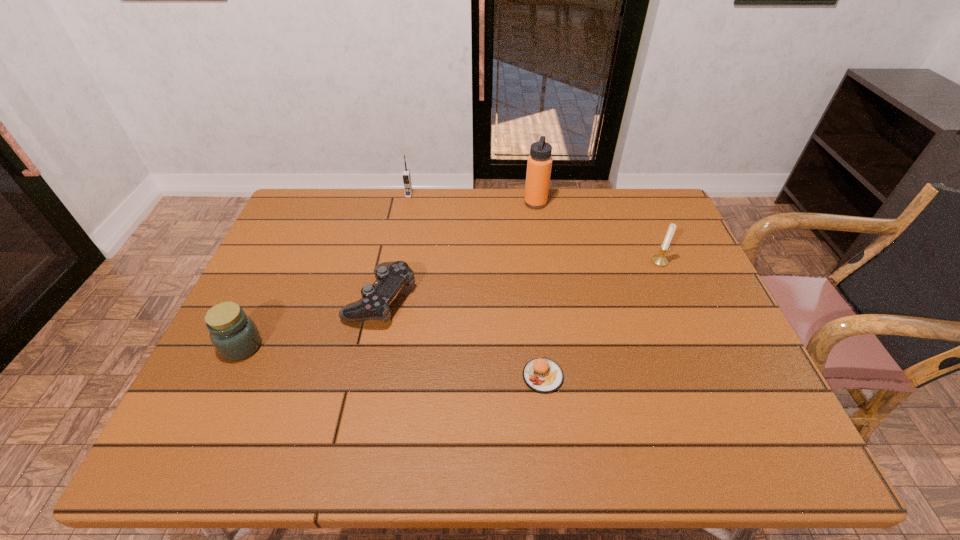
The width and height of the screenshot is (960, 540). Identify the location of vacant space situated 0.130m on the right of the jar. (317, 346).

You are a GUI agent. You are given a task and a screenshot of the screen. Output one action in this format:
    pyautogui.click(x=<x>, y=<y>)
    Task: Click on the vacant space located on the left of the control
    The image size is (960, 540).
    Given the screenshot: What is the action you would take?
    pyautogui.click(x=248, y=299)

Locate an element on the screen. vacant point located on the left of the patty is located at coordinates (368, 376).

I want to click on thermos bottle that is at the far edge, so click(x=539, y=163).

Locate an element on the screen. The height and width of the screenshot is (540, 960). cellular telephone at the far edge is located at coordinates (406, 176).

Where is `object located at the left edge`? The image size is (960, 540). object located at the left edge is located at coordinates (235, 336).

At what (x,y) coordinates should I click in order to perform the action: click on object positioned at the right edge. Please return your answer as a coordinate pair (x, y). Image resolution: width=960 pixels, height=540 pixels. Looking at the image, I should click on (660, 260).

Find the location of `free region at the far edge of the desktop`. free region at the far edge of the desktop is located at coordinates (504, 198).

Find the location of a particular element. This screenshot has width=960, height=540. free location at the near edge is located at coordinates (416, 458).

At what (x,y) coordinates should I click in order to perform the action: click on vacant space at the left edge of the desktop. Please return your answer as a coordinate pair (x, y). Looking at the image, I should click on (280, 330).